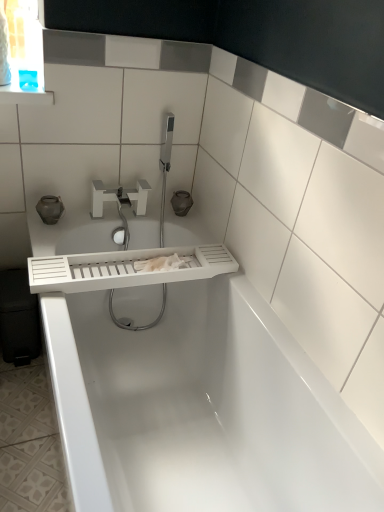
Question: Is white glossy bathtub at center with white plastic tap at upper center?

Choices:
 (A) no
 (B) yes

Answer: (A)

Question: Can you confirm if white glossy bathtub at center is smaller than white plastic tap at upper center?

Choices:
 (A) no
 (B) yes

Answer: (A)

Question: Is white glossy bathtub at center turned away from white plastic tap at upper center?

Choices:
 (A) no
 (B) yes

Answer: (A)

Question: Would you say white plastic tap at upper center is part of white glossy bathtub at center's contents?

Choices:
 (A) yes
 (B) no

Answer: (B)

Question: From a real-world perspective, is white glossy bathtub at center physically below white plastic tap at upper center?

Choices:
 (A) yes
 (B) no

Answer: (A)

Question: Would you say white glossy bathtub at center is to the left or to the right of white plastic tap at upper center in the picture?

Choices:
 (A) right
 (B) left

Answer: (A)

Question: Looking at the image, does white glossy bathtub at center seem bigger or smaller compared to white plastic tap at upper center?

Choices:
 (A) big
 (B) small

Answer: (A)

Question: Does point (129, 371) appear closer or farther from the camera than point (125, 202)?

Choices:
 (A) farther
 (B) closer

Answer: (B)

Question: In terms of height, does white glossy bathtub at center look taller or shorter compared to white plastic tap at upper center?

Choices:
 (A) short
 (B) tall

Answer: (B)

Question: Based on their sizes in the image, would you say white matte tray at center is bigger or smaller than white plastic tap at upper center?

Choices:
 (A) big
 (B) small

Answer: (A)

Question: In terms of height, does white matte tray at center look taller or shorter compared to white plastic tap at upper center?

Choices:
 (A) short
 (B) tall

Answer: (A)

Question: From a real-world perspective, is white matte tray at center physically located above or below white plastic tap at upper center?

Choices:
 (A) below
 (B) above

Answer: (A)

Question: Considering the positions of point [193, 279] and point [114, 188], is point [193, 279] closer or farther from the camera than point [114, 188]?

Choices:
 (A) farther
 (B) closer

Answer: (B)

Question: Looking at the image, does white plastic tap at upper center seem bigger or smaller compared to white glossy bathtub at center?

Choices:
 (A) small
 (B) big

Answer: (A)

Question: In terms of width, does white plastic tap at upper center look wider or thinner when compared to white glossy bathtub at center?

Choices:
 (A) thin
 (B) wide

Answer: (A)